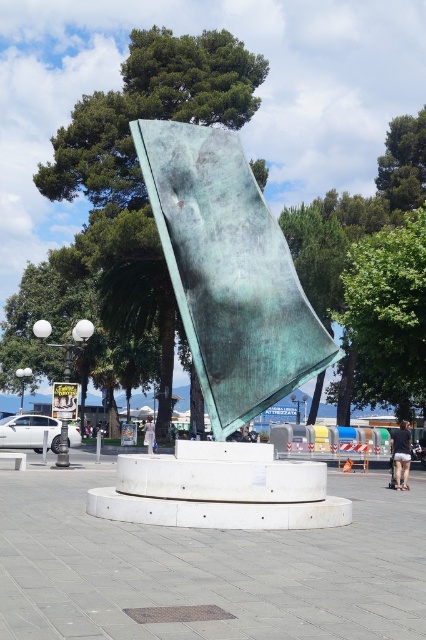
Does green leafy tree at center appear on the right side of white fabric person at center?

Yes, green leafy tree at center is to the right of white fabric person at center.

Does point (394, 388) come closer to viewer compared to point (152, 424)?

No, it is behind (152, 424).

The width and height of the screenshot is (426, 640). I want to click on green leafy tree at center, so click(x=385, y=317).

Between smooth concrete base at center and green patina metal at center, which one appears on the left side from the viewer's perspective?

From the viewer's perspective, green patina metal at center appears more on the left side.

Which is below, smooth concrete base at center or green patina metal at center?

Positioned lower is smooth concrete base at center.

The width and height of the screenshot is (426, 640). I want to click on smooth concrete base at center, so pyautogui.click(x=207, y=568).

Does green leafy tree at upper center lie in front of green leafy tree at center?

No, it is not.

Can you confirm if green leafy tree at upper center is shorter than green leafy tree at center?

No.

Is point (147, 280) farther from camera compared to point (340, 369)?

That is False.

The height and width of the screenshot is (640, 426). I want to click on green leafy tree at upper center, so click(x=138, y=164).